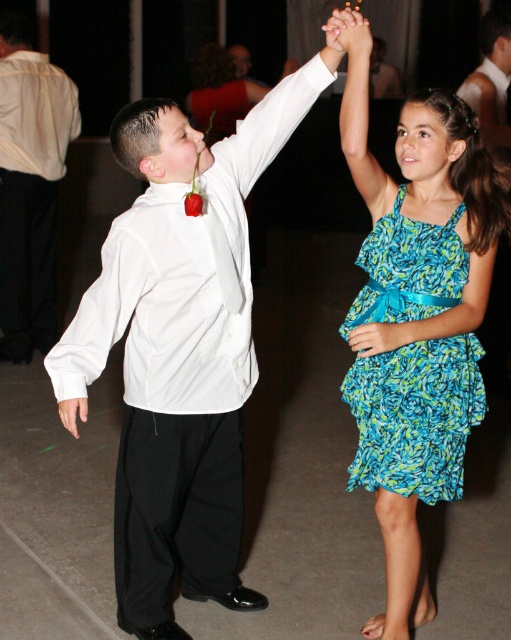
Is white satin shirt at upper left thinner than white satin shirt at upper center?

Incorrect, white satin shirt at upper left's width is not less than white satin shirt at upper center's.

Is white satin shirt at upper left shorter than white satin shirt at upper center?

No, white satin shirt at upper left is not shorter than white satin shirt at upper center.

Is point (171, 193) farther from viewer compared to point (470, 80)?

No, (171, 193) is closer to viewer.

I want to click on white satin shirt at upper left, so click(x=183, y=276).

Can you confirm if blue printed dress at upper right is positioned below white satin shirt at left?

Yes.

Does point (361, 380) come closer to viewer compared to point (43, 168)?

Yes, point (361, 380) is closer to viewer.

You are a GUI agent. You are given a task and a screenshot of the screen. Output one action in this format:
    pyautogui.click(x=<x>, y=<y>)
    Task: Click on the blue printed dress at upper right
    
    Given the screenshot: What is the action you would take?
    pyautogui.click(x=425, y=202)

Who is positioned more to the right, white satin shirt at left or white satin shirt at upper center?

From the viewer's perspective, white satin shirt at upper center appears more on the right side.

Does point (49, 156) lie in front of point (493, 28)?

No, (49, 156) is further to viewer.

Find the location of `white satin shirt at left`. white satin shirt at left is located at coordinates (30, 186).